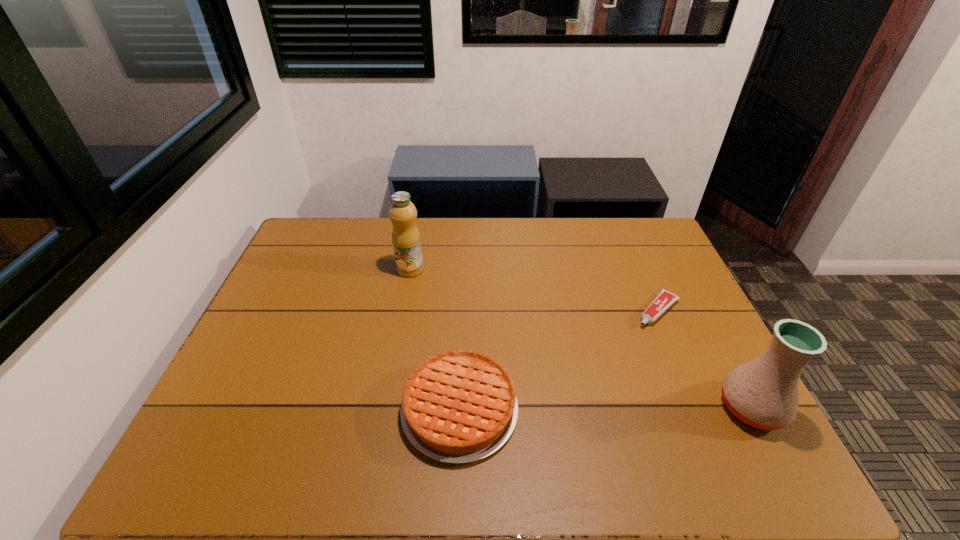
You are a GUI agent. You are given a task and a screenshot of the screen. Output one action in this format:
    pyautogui.click(x=<x>, y=<y>)
    Task: Click on the vacant space at the left edge of the desktop
    The width and height of the screenshot is (960, 540).
    Given the screenshot: What is the action you would take?
    pyautogui.click(x=269, y=315)

Where is `vacant space at the right edge of the desktop`? The image size is (960, 540). vacant space at the right edge of the desktop is located at coordinates (688, 391).

In the image, there is a desktop. Where is `vacant space at the far right corner`? vacant space at the far right corner is located at coordinates (658, 255).

This screenshot has height=540, width=960. I want to click on vacant area that lies between the toothpaste and the pottery, so click(705, 359).

The height and width of the screenshot is (540, 960). I want to click on empty space that is in between the fruit juice and the pie, so click(x=435, y=340).

Find the location of a particular element. free space between the farthest object and the second shortest object is located at coordinates (435, 340).

At what (x,y) coordinates should I click in order to perform the action: click on unoccupied position between the fruit juice and the toothpaste. Please return your answer as a coordinate pair (x, y). This screenshot has height=540, width=960. Looking at the image, I should click on (534, 290).

You are a GUI agent. You are given a task and a screenshot of the screen. Output one action in this format:
    pyautogui.click(x=<x>, y=<y>)
    Task: Click on the vacant space that is in between the second shortest object and the shortest object
    The width and height of the screenshot is (960, 540).
    Given the screenshot: What is the action you would take?
    pyautogui.click(x=559, y=360)

Identify the location of free point between the pottery and the pie. The image size is (960, 540). (606, 408).

Identify the location of free space between the toothpaste and the pottery. (705, 359).